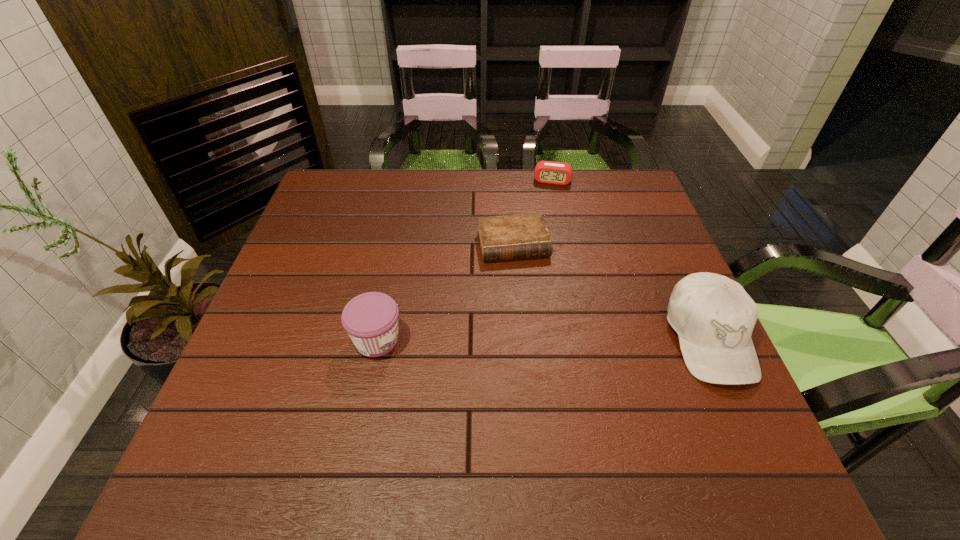
The height and width of the screenshot is (540, 960). In order to click on free space located 0.340m on the front-facing side of the third tallest object in this screenshot , I will do pyautogui.click(x=539, y=258).

In order to click on vacant space situated on the front-facing side of the third tallest object in this screenshot , I will do `click(537, 268)`.

Image resolution: width=960 pixels, height=540 pixels. I want to click on vacant space located on the front-facing side of the third tallest object, so click(540, 253).

This screenshot has width=960, height=540. Find the location of `vacant space positioned on the spine side of the diary`. vacant space positioned on the spine side of the diary is located at coordinates (547, 370).

At what (x,y) coordinates should I click in order to perform the action: click on vacant region located 0.360m on the spine side of the diary. Please return your answer as a coordinate pair (x, y). The width and height of the screenshot is (960, 540). Looking at the image, I should click on (552, 387).

Locate an element on the screen. Image resolution: width=960 pixels, height=540 pixels. vacant region located 0.060m on the spine side of the diary is located at coordinates (523, 281).

Image resolution: width=960 pixels, height=540 pixels. I want to click on object located at the far edge, so click(549, 172).

The image size is (960, 540). What are the coordinates of `object positioned at the near edge` in the screenshot? It's located at (714, 317).

Find the location of `object at the right edge`. object at the right edge is located at coordinates (714, 317).

Identify the location of object that is at the near right corner. The height and width of the screenshot is (540, 960). (714, 317).